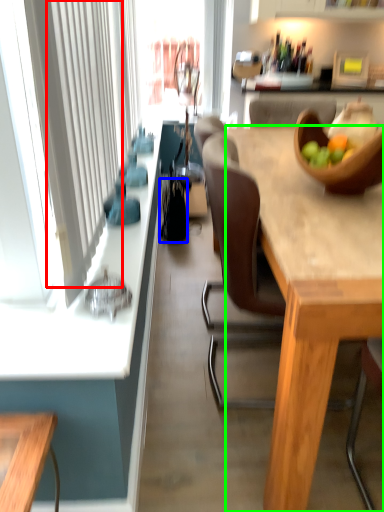
Question: Considering the real-world distances, which object is closest to curtain (highlighted by a red box)? handbag (highlighted by a blue box) or desk (highlighted by a green box).

Choices:
 (A) handbag
 (B) desk

Answer: (B)